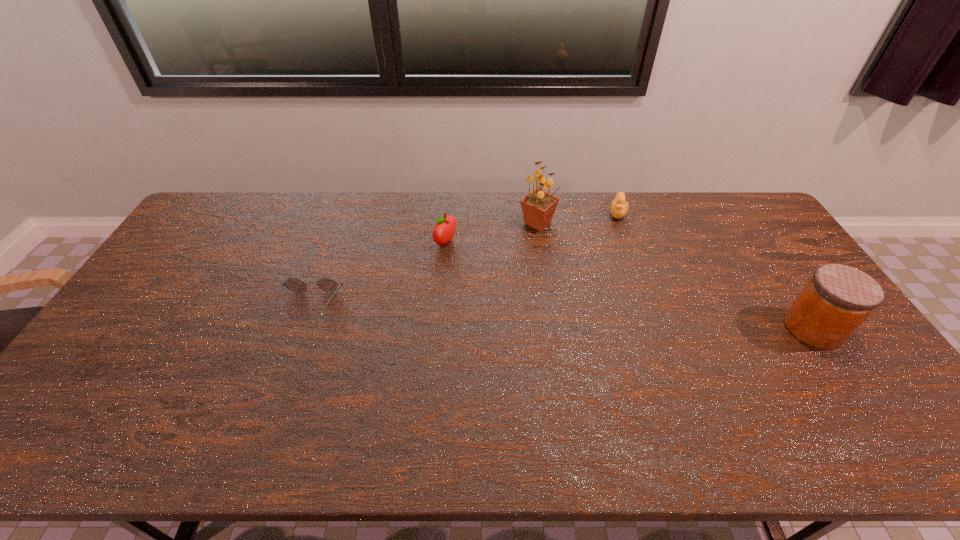
Where is `blank space located on the front-facing side of the spectacles`? The width and height of the screenshot is (960, 540). blank space located on the front-facing side of the spectacles is located at coordinates 295,350.

Where is `blank space located on the back of the rightmost object`? The width and height of the screenshot is (960, 540). blank space located on the back of the rightmost object is located at coordinates (745, 228).

Identify the location of free point located on the face of the second shortest object. This screenshot has height=540, width=960. (611, 287).

The height and width of the screenshot is (540, 960). Find the location of `vacant space positioned 0.300m on the face of the second shortest object`. vacant space positioned 0.300m on the face of the second shortest object is located at coordinates (612, 280).

Where is `vacant area situated 0.300m on the face of the second shortest object`? vacant area situated 0.300m on the face of the second shortest object is located at coordinates (612, 280).

You are a GUI agent. You are given a task and a screenshot of the screen. Output one action in this format:
    pyautogui.click(x=<x>, y=<y>)
    Task: Click on the vacant space positioned on the front-facing side of the second object from left to right
    This screenshot has height=540, width=960.
    Given the screenshot: What is the action you would take?
    pyautogui.click(x=559, y=302)

Identify the location of vacant space located on the front-facing side of the second object from left to right. (559, 302).

The image size is (960, 540). What are the coordinates of `free region located 0.370m on the front-facing side of the second object from left to right` in the screenshot? It's located at (550, 298).

At what (x,y) coordinates should I click in order to perform the action: click on vacant space located 0.190m at the front of the sunflower with flowers visible. Please return your answer as a coordinate pair (x, y). Looking at the image, I should click on (555, 273).

Where is `vacant area located 0.260m at the front of the sunflower with flowers visible`? The height and width of the screenshot is (540, 960). vacant area located 0.260m at the front of the sunflower with flowers visible is located at coordinates (561, 289).